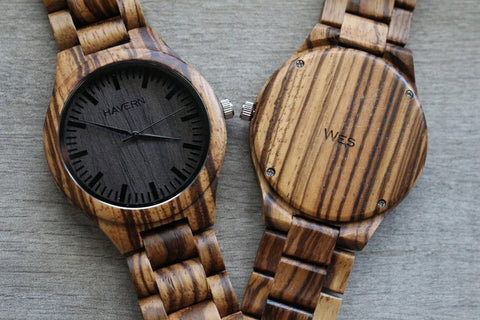
The image size is (480, 320). What are the coordinates of `table top to the right` in the screenshot? It's located at (428, 254).